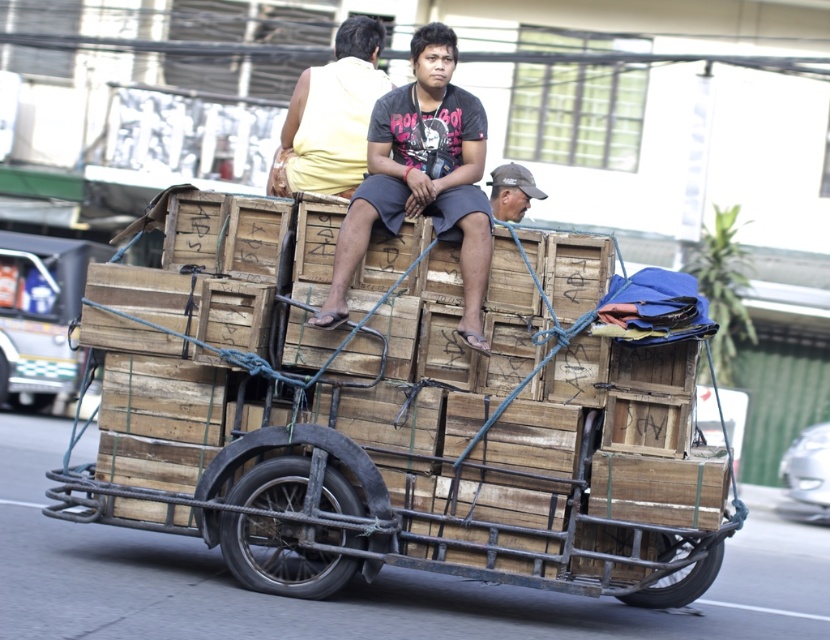
Question: Among these points, which one is farthest from the camera?

Choices:
 (A) (325, 145)
 (B) (533, 465)

Answer: (A)

Question: Is the position of matte yellow shirt at upper center less distant than that of dark gray baseball cap at upper center?

Choices:
 (A) yes
 (B) no

Answer: (B)

Question: Which of the following is the farthest from the observer?

Choices:
 (A) (531, 177)
 (B) (293, 186)
 (C) (325, 493)

Answer: (A)

Question: In this image, where is matte yellow shirt at upper center located relative to dark gray baseball cap at upper center?

Choices:
 (A) left
 (B) right

Answer: (A)

Question: Does wooden crates at center have a smaller size compared to matte yellow shirt at upper center?

Choices:
 (A) yes
 (B) no

Answer: (B)

Question: Among these points, which one is farthest from the camera?

Choices:
 (A) (433, 208)
 (B) (498, 176)
 (C) (306, 346)
 (D) (347, 106)

Answer: (B)